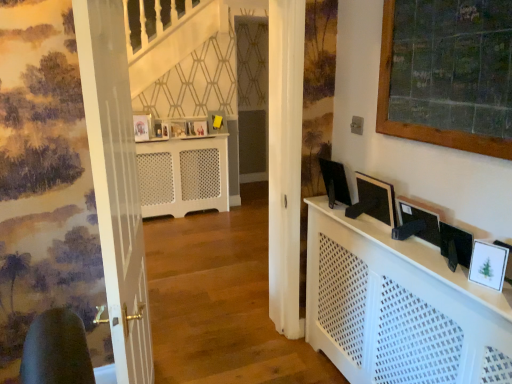
Question: Is matte white picture frame at center, the 2th picture frame viewed from the top, thinner than matte wooden picture frame at center, the second picture frame viewed from the left?

Choices:
 (A) no
 (B) yes

Answer: (A)

Question: Is matte white picture frame at center, the 4th picture frame in the front-to-back sequence, to the left of matte wooden picture frame at center, the third picture frame when ordered from bottom to top, from the viewer's perspective?

Choices:
 (A) yes
 (B) no

Answer: (B)

Question: Is matte white picture frame at center, the 2th picture frame viewed from the top, to the right of matte wooden picture frame at center, the third picture frame when ordered from bottom to top, from the viewer's perspective?

Choices:
 (A) yes
 (B) no

Answer: (A)

Question: Does matte white picture frame at center, the 2th picture frame viewed from the top, touch matte wooden picture frame at center, which ranks as the 4th picture frame in right-to-left order?

Choices:
 (A) no
 (B) yes

Answer: (A)

Question: Is matte white picture frame at center, positioned as the 3th picture frame in left-to-right order, oriented towards matte wooden picture frame at center, the second picture frame viewed from the left?

Choices:
 (A) yes
 (B) no

Answer: (B)

Question: From their relative heights in the image, would you say wooden framed chalkboard at upper right is taller or shorter than matte yellow picture frame at center, arranged as the 4th picture frame when viewed from the left?

Choices:
 (A) tall
 (B) short

Answer: (A)

Question: From the image's perspective, relative to matte yellow picture frame at center, which appears as the first picture frame when viewed from the back, is wooden framed chalkboard at upper right above or below?

Choices:
 (A) above
 (B) below

Answer: (B)

Question: From a real-world perspective, is wooden framed chalkboard at upper right above or below matte yellow picture frame at center, arranged as the 4th picture frame when viewed from the left?

Choices:
 (A) below
 (B) above

Answer: (B)

Question: Visually, is wooden framed chalkboard at upper right positioned to the left or to the right of matte yellow picture frame at center, which is the 5th picture frame in front-to-back order?

Choices:
 (A) right
 (B) left

Answer: (A)

Question: Considering the positions of matte black monitor at right, positioned as the 2th computer monitor in left-to-right order, and matte wooden picture frame at center, arranged as the 3th picture frame when viewed from the front, in the image, is matte black monitor at right, positioned as the 2th computer monitor in left-to-right order, taller or shorter than matte wooden picture frame at center, arranged as the 3th picture frame when viewed from the front,?

Choices:
 (A) short
 (B) tall

Answer: (B)

Question: Considering the relative positions of matte black monitor at right, placed as the 2th computer monitor when sorted from right to left, and matte wooden picture frame at center, which ranks as the 4th picture frame in right-to-left order, in the image provided, is matte black monitor at right, placed as the 2th computer monitor when sorted from right to left, to the left or to the right of matte wooden picture frame at center, which ranks as the 4th picture frame in right-to-left order,?

Choices:
 (A) left
 (B) right

Answer: (B)

Question: Would you say matte black monitor at right, which is the 2th computer monitor in front-to-back order, is inside or outside matte wooden picture frame at center, which ranks as the 4th picture frame in right-to-left order?

Choices:
 (A) outside
 (B) inside

Answer: (A)

Question: Is matte black monitor at right, positioned as the 2th computer monitor in left-to-right order, bigger or smaller than matte wooden picture frame at center, the second picture frame viewed from the left?

Choices:
 (A) big
 (B) small

Answer: (A)

Question: Considering their positions, is white glossy picture frame at lower right, which is counted as the fifth picture frame, starting from the left, located in front of or behind black glossy monitor at right, which is counted as the third computer monitor, starting from the right?

Choices:
 (A) front
 (B) behind

Answer: (A)

Question: In terms of height, does white glossy picture frame at lower right, arranged as the 1th picture frame when viewed from the right, look taller or shorter compared to black glossy monitor at right, the 3th computer monitor from the front?

Choices:
 (A) short
 (B) tall

Answer: (A)